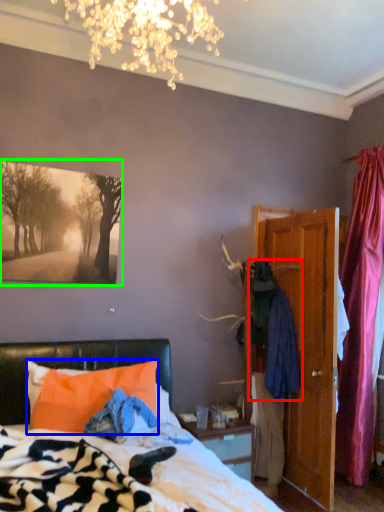
Question: Which object is the farthest from clothing (highlighted by a red box)? Choose among these: pillow (highlighted by a blue box) or picture frame (highlighted by a green box).

Choices:
 (A) pillow
 (B) picture frame

Answer: (B)